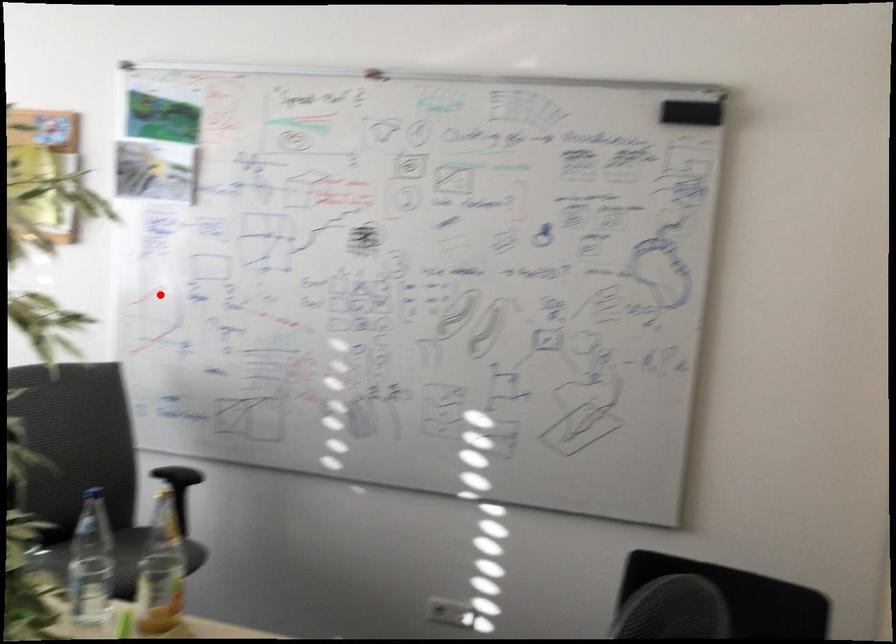
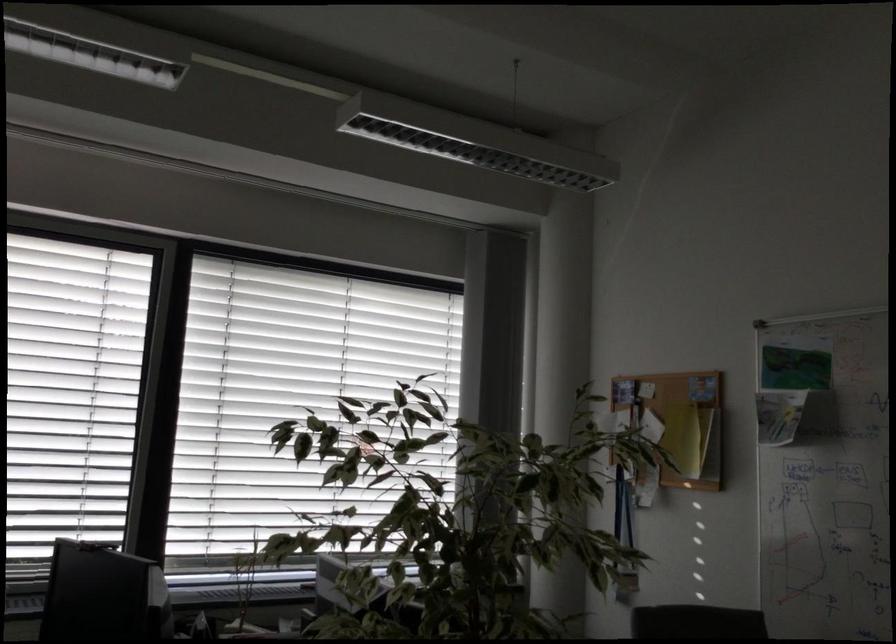
In the second image, find the point that corresponds to the highlighted location in the first image.

(786, 538)